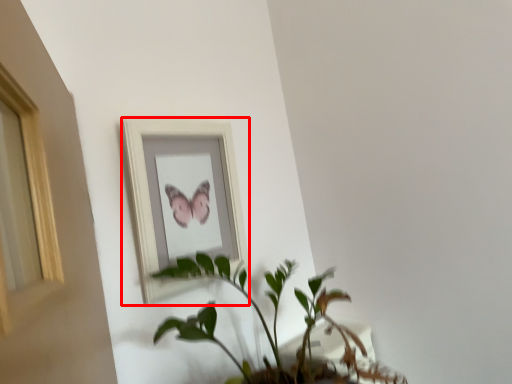
Question: Considering the relative positions of picture frame (annotated by the red box) and houseplant in the image provided, where is picture frame (annotated by the red box) located with respect to the staircase?

Choices:
 (A) right
 (B) left

Answer: (B)